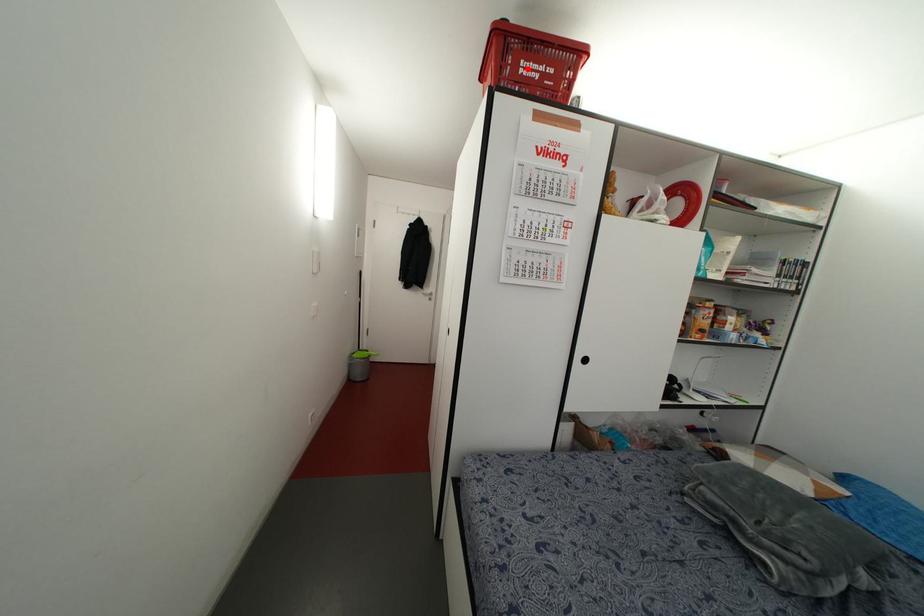
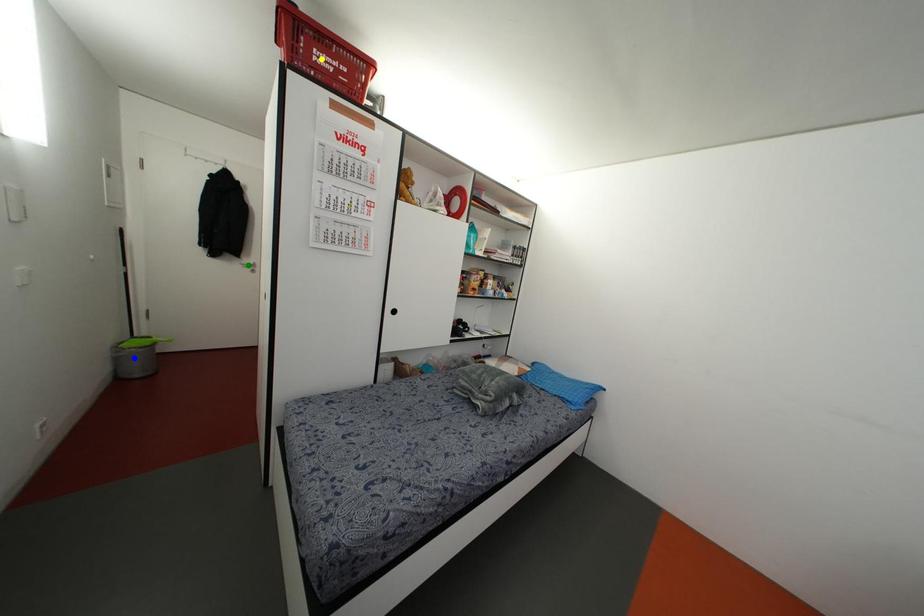
Question: I am providing you with two images of the same scene from different viewpoints. A red point is marked on the first image. You are given multiple points on the second image. Which mark in image 2 goes with the point in image 1?

Choices:
 (A) blue point
 (B) yellow point
 (C) green point

Answer: (B)